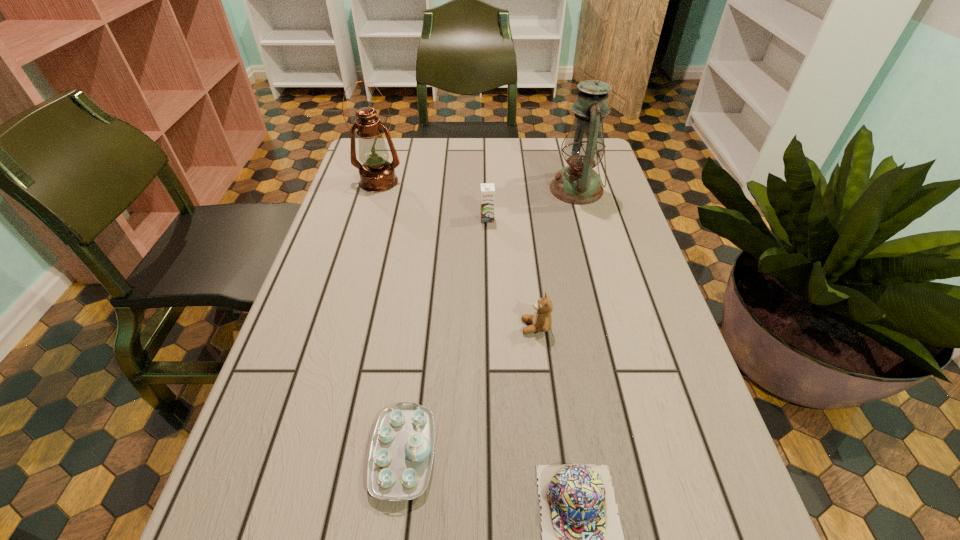
This screenshot has height=540, width=960. I want to click on object that is the fifth closest to the chinaware, so click(x=377, y=174).